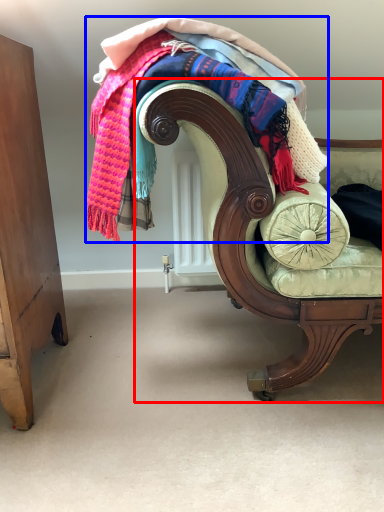
Question: Which point is closer to the camera, chair (highlighted by a red box) or laundry (highlighted by a blue box)?

Choices:
 (A) chair
 (B) laundry

Answer: (A)